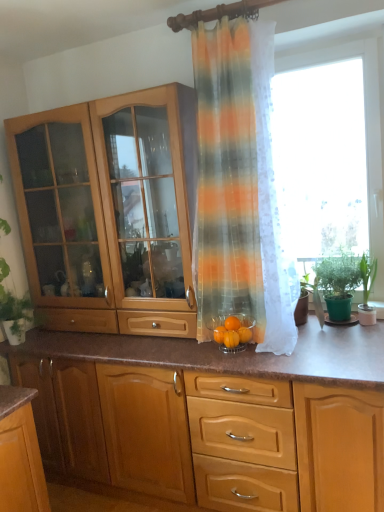
Image resolution: width=384 pixels, height=512 pixels. In order to click on vacant space in front of green matte plant at right, which is counted as the first houseplant, starting from the left in this screenshot , I will do `click(350, 338)`.